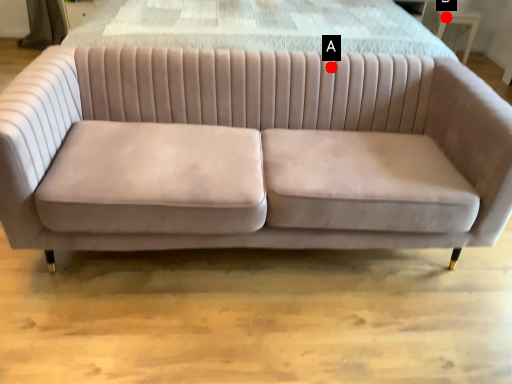
Question: Two points are circled on the image, labeled by A and B beside each circle. Which point is further to the camera?

Choices:
 (A) A is further
 (B) B is further

Answer: (B)